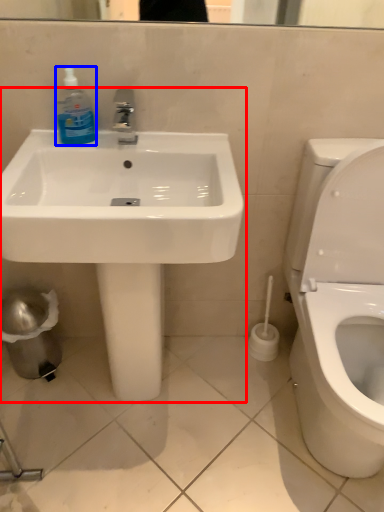
Question: Which object appears closest to the camera in this image, sink (highlighted by a red box) or cleaning product (highlighted by a blue box)?

Choices:
 (A) sink
 (B) cleaning product

Answer: (A)